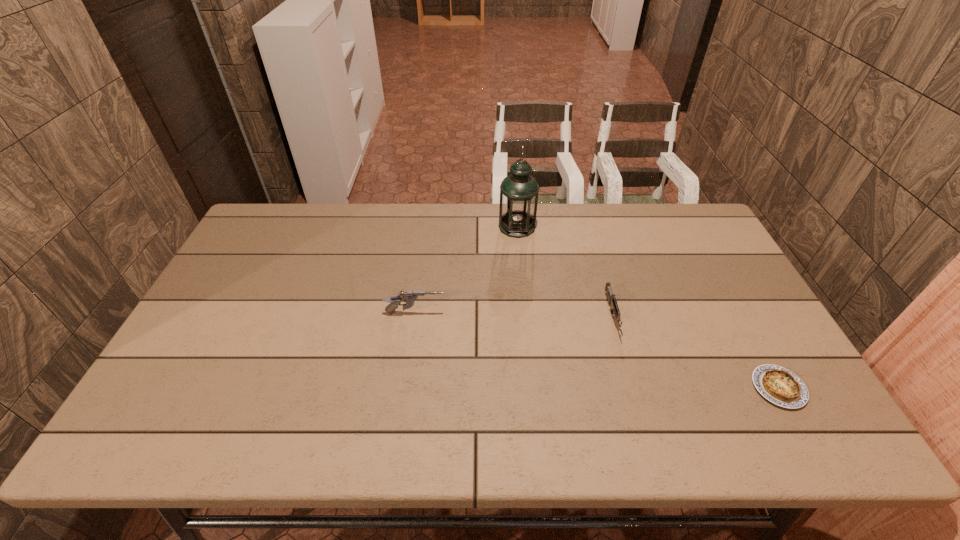
Find the location of `free space located aimed along the barrel of the right gun`. free space located aimed along the barrel of the right gun is located at coordinates (641, 416).

Where is `vacant space situated on the left of the shortest object`? vacant space situated on the left of the shortest object is located at coordinates (699, 388).

The image size is (960, 540). Identify the location of object at the far edge. (519, 191).

Where is `object at the right edge`? The height and width of the screenshot is (540, 960). object at the right edge is located at coordinates (777, 384).

Locate an element on the screen. This screenshot has width=960, height=540. free space at the far edge of the desktop is located at coordinates (333, 237).

The height and width of the screenshot is (540, 960). In the image, there is a desktop. In order to click on vacant region at the near edge in this screenshot , I will do `click(446, 447)`.

Where is `vacant region at the left edge`? vacant region at the left edge is located at coordinates (235, 254).

In the image, there is a desktop. What are the coordinates of `vacant space at the right edge` in the screenshot? It's located at (739, 299).

In the image, there is a desktop. Where is `free region at the far left corner`? The width and height of the screenshot is (960, 540). free region at the far left corner is located at coordinates (272, 210).

This screenshot has width=960, height=540. I want to click on free space at the near left corner of the desktop, so click(153, 416).